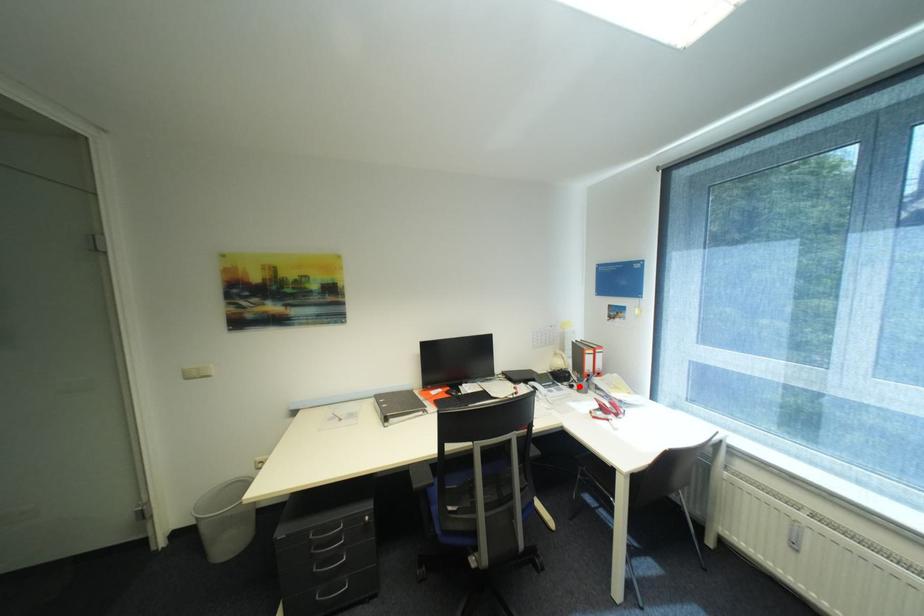
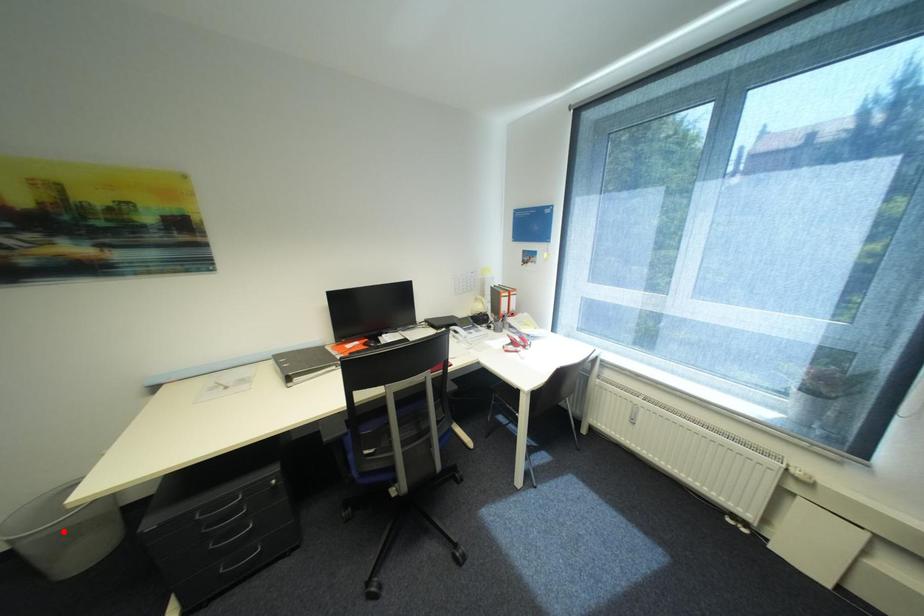
I am providing you with two images of the same scene from different viewpoints. A red point is marked on the first image and another point is marked on the second image. Does the point marked in image1 correspond to the same location as the one in image2?

No